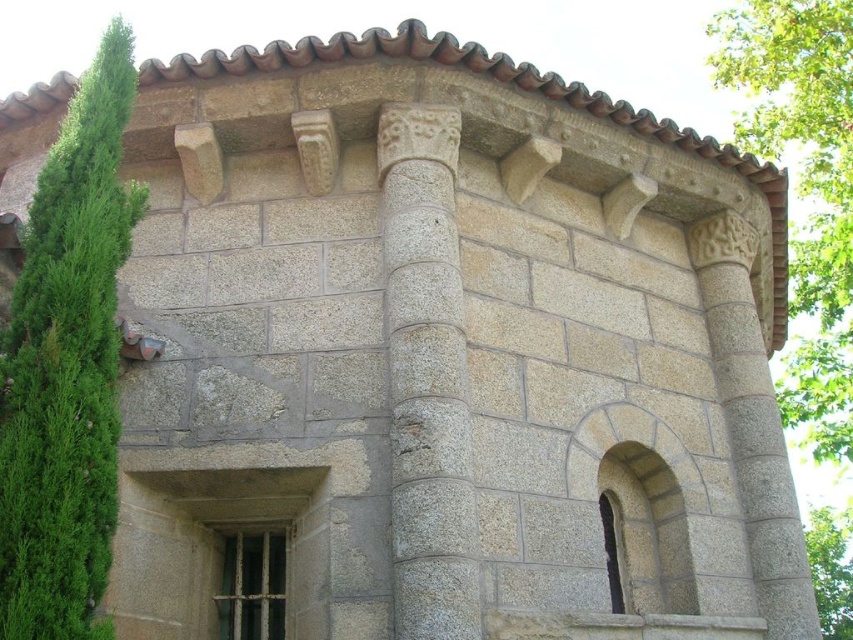
Question: Can you confirm if green leafy tree at left is positioned above green leafy tree at upper right?

Choices:
 (A) no
 (B) yes

Answer: (B)

Question: Does green leafy tree at left have a lesser width compared to green leafy tree at upper right?

Choices:
 (A) yes
 (B) no

Answer: (A)

Question: Which point is closer to the camera?

Choices:
 (A) (809, 209)
 (B) (82, 541)
 (C) (434, 108)

Answer: (B)

Question: Considering the real-world distances, which object is closest to the green leafy tree at upper right?

Choices:
 (A) green leafy tree at left
 (B) gray stone column at center

Answer: (B)

Question: Which object appears farthest from the camera in this image?

Choices:
 (A) gray stone column at center
 (B) green leafy tree at left

Answer: (A)

Question: Does green leafy tree at left appear on the right side of green leafy tree at upper right?

Choices:
 (A) yes
 (B) no

Answer: (B)